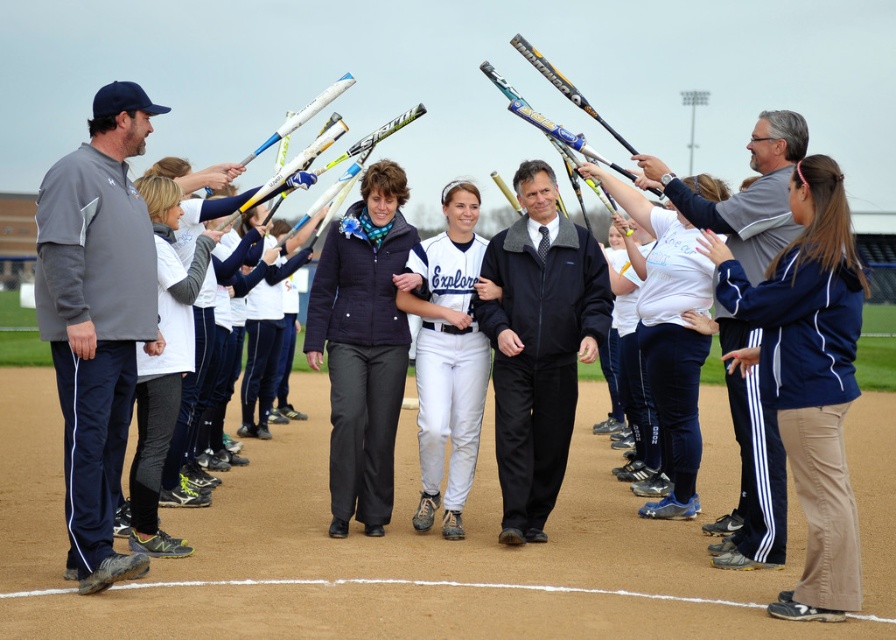
You are a photographer at the baseball field event. You need to capture a closeup shot of both the blue track pants at center and the white matte uniform at center. Since your camera can only focus on one width at a time, which object should you adjust the focus for first based on their widths?

The blue track pants at center is wider than the white matte uniform at center, so you should adjust the focus for the blue track pants at center first to ensure proper framing.

You are a photographer positioned at the edge of the baseball field. You need to capture a photo of both the blue track pants at center and the white matte uniform at center. Given that your camera has a maximum focus range of 10 feet, can you capture both subjects in focus without moving?

The distance between the blue track pants at center and the white matte uniform at center is 12.05 feet, which exceeds the camera maximum focus range of 10 feet. Therefore, you cannot capture both subjects in focus without moving.

You are a photographer at the event and need to capture a photo where both the blue track pants at center and the white matte uniform at center are visible. Which object should you ensure is closer to the camera to avoid it being blocked by the other?

The blue track pants at center is not as tall as the white matte uniform at center, so you should ensure the blue track pants at center is closer to the camera to avoid it being blocked by the taller white matte uniform at center.